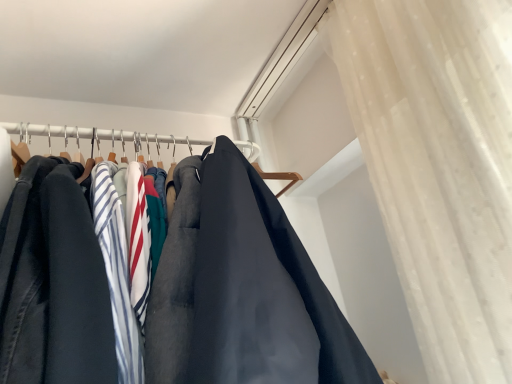
Question: In the image, is dark gray fabric pants at left positioned in front of or behind sheer white curtain at upper right?

Choices:
 (A) behind
 (B) front

Answer: (A)

Question: Considering the relative positions of dark gray fabric pants at left and sheer white curtain at upper right in the image provided, is dark gray fabric pants at left to the left or to the right of sheer white curtain at upper right?

Choices:
 (A) left
 (B) right

Answer: (A)

Question: Considering the positions of dark gray fabric pants at left and sheer white curtain at upper right in the image, is dark gray fabric pants at left wider or thinner than sheer white curtain at upper right?

Choices:
 (A) thin
 (B) wide

Answer: (A)

Question: From their relative heights in the image, would you say sheer white curtain at upper right is taller or shorter than dark gray fabric pants at left?

Choices:
 (A) short
 (B) tall

Answer: (B)

Question: Based on their sizes in the image, would you say sheer white curtain at upper right is bigger or smaller than dark gray fabric pants at left?

Choices:
 (A) big
 (B) small

Answer: (A)

Question: From the image's perspective, is sheer white curtain at upper right above or below dark gray fabric pants at left?

Choices:
 (A) below
 (B) above

Answer: (B)

Question: Does point (498, 342) appear closer or farther from the camera than point (250, 160)?

Choices:
 (A) closer
 (B) farther

Answer: (A)